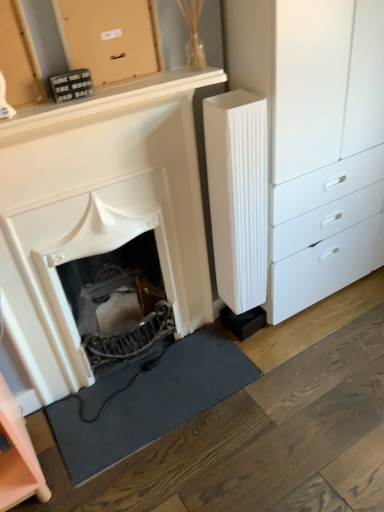
Describe the element at coordinates (98, 212) in the screenshot. I see `white matte fireplace at center` at that location.

You are a GUI agent. You are given a task and a screenshot of the screen. Output one action in this format:
    pyautogui.click(x=<x>, y=<y>)
    Task: Click on the white matte chest of drawers at right
    The height and width of the screenshot is (512, 384).
    Given the screenshot: What is the action you would take?
    pyautogui.click(x=316, y=137)

The width and height of the screenshot is (384, 512). What do you see at coordinates (109, 38) in the screenshot?
I see `wooden board at upper center, which is the 1th cabinetry in right-to-left order` at bounding box center [109, 38].

Measure the distance between black rubber doormat at lower left and camera.

A distance of 4.36 feet exists between black rubber doormat at lower left and camera.

What do you see at coordinates (18, 457) in the screenshot? Image resolution: width=384 pixels, height=512 pixels. I see `pink matte cabinet at lower left, the second cabinetry in the right-to-left sequence` at bounding box center [18, 457].

I want to click on white matte fireplace at center, so pos(98,212).

Is white matte fireplace at center thinner than white ribbed radiator at right?

Incorrect, the width of white matte fireplace at center is not less than that of white ribbed radiator at right.

Measure the distance between white matte fireplace at center and white ribbed radiator at right.

white matte fireplace at center is 11.62 inches away from white ribbed radiator at right.

Is white matte fireplace at center smaller than white ribbed radiator at right?

Actually, white matte fireplace at center might be larger than white ribbed radiator at right.

Which is correct: white matte fireplace at center is inside white ribbed radiator at right, or outside of it?

The correct answer is: outside.

Does point (295, 120) come behind point (72, 221)?

Yes, point (295, 120) is behind point (72, 221).

Who is more distant, white matte chest of drawers at right or white matte fireplace at center?

Positioned behind is white matte chest of drawers at right.

In the image, is white matte chest of drawers at right on the left side or the right side of white matte fireplace at center?

Clearly, white matte chest of drawers at right is on the right of white matte fireplace at center in the image.

From a real-world perspective, is white matte chest of drawers at right positioned under white matte fireplace at center based on gravity?

Actually, white matte chest of drawers at right is physically above white matte fireplace at center in the real world.

Can you confirm if white ribbed radiator at right is taller than white matte chest of drawers at right?

No.

From the image's perspective, between white ribbed radiator at right and white matte chest of drawers at right, which one is located above?

white matte chest of drawers at right is shown above in the image.

Which is behind, white ribbed radiator at right or white matte chest of drawers at right?

white ribbed radiator at right is further away from the camera.

Can you confirm if white ribbed radiator at right is wider than white matte chest of drawers at right?

No, white ribbed radiator at right is not wider than white matte chest of drawers at right.

The height and width of the screenshot is (512, 384). I want to click on the chest of drawers that is behind the wooden board at upper center, which is the 1th cabinetry in right-to-left order, so click(x=316, y=137).

In the scene shown: Considering the relative positions of white matte chest of drawers at right and wooden board at upper center, which is the 1th cabinetry in right-to-left order, in the image provided, is white matte chest of drawers at right to the left of wooden board at upper center, which is the 1th cabinetry in right-to-left order, from the viewer's perspective?

No.

Is white matte chest of drawers at right not close to wooden board at upper center, arranged as the first cabinetry when viewed from the top?

white matte chest of drawers at right is near wooden board at upper center, arranged as the first cabinetry when viewed from the top, not far away.

From a real-world perspective, who is located higher, white matte chest of drawers at right or wooden board at upper center, which is the 1th cabinetry in right-to-left order?

In real-world perspective, wooden board at upper center, which is the 1th cabinetry in right-to-left order, is above.

Is the position of pink matte cabinet at lower left, the second cabinetry in the right-to-left sequence, more distant than that of wooden board at upper center, placed as the 2th cabinetry when sorted from bottom to top?

Yes, pink matte cabinet at lower left, the second cabinetry in the right-to-left sequence, is behind wooden board at upper center, placed as the 2th cabinetry when sorted from bottom to top.

Image resolution: width=384 pixels, height=512 pixels. What are the coordinates of `cabinetry above the pink matte cabinet at lower left, the second cabinetry in the right-to-left sequence (from a real-world perspective)` in the screenshot? It's located at (109, 38).

How distant is pink matte cabinet at lower left, which is the 1th cabinetry from bottom to top, from wooden board at upper center, arranged as the first cabinetry when viewed from the top?

pink matte cabinet at lower left, which is the 1th cabinetry from bottom to top, and wooden board at upper center, arranged as the first cabinetry when viewed from the top, are 38.54 inches apart from each other.

Which is further, (40, 474) or (86, 38)?

The point (40, 474) is behind.

You are a GUI agent. You are given a task and a screenshot of the screen. Output one action in this format:
    pyautogui.click(x=<x>, y=<y>)
    Task: Click on the fireplace below the wooden board at upper center, which is the 1th cabinetry in right-to-left order (from the image's perspective)
    Image resolution: width=384 pixels, height=512 pixels.
    Given the screenshot: What is the action you would take?
    pyautogui.click(x=98, y=212)

Can you confirm if wooden board at upper center, which is the 1th cabinetry in right-to-left order, is smaller than white matte fireplace at center?

Indeed, wooden board at upper center, which is the 1th cabinetry in right-to-left order, has a smaller size compared to white matte fireplace at center.

Considering the sizes of objects wooden board at upper center, placed as the 2th cabinetry when sorted from bottom to top, and white matte fireplace at center in the image provided, who is shorter, wooden board at upper center, placed as the 2th cabinetry when sorted from bottom to top, or white matte fireplace at center?

wooden board at upper center, placed as the 2th cabinetry when sorted from bottom to top, is shorter.

Is pink matte cabinet at lower left, the second cabinetry in the right-to-left sequence, in front of or behind white matte fireplace at center in the image?

pink matte cabinet at lower left, the second cabinetry in the right-to-left sequence, is behind white matte fireplace at center.

Considering the points (16, 480) and (117, 167), which point is in front, point (16, 480) or point (117, 167)?

Point (16, 480)

Image resolution: width=384 pixels, height=512 pixels. What are the coordinates of `cabinetry on the left of white matte fireplace at center` in the screenshot? It's located at (x=18, y=457).

Would you say white matte fireplace at center is part of pink matte cabinet at lower left, which is the 1th cabinetry from bottom to top,'s contents?

No, white matte fireplace at center is located outside of pink matte cabinet at lower left, which is the 1th cabinetry from bottom to top.

This screenshot has width=384, height=512. I want to click on fireplace located in front of the white ribbed radiator at right, so click(98, 212).

Image resolution: width=384 pixels, height=512 pixels. Identify the location of the chest of drawers above the white matte fireplace at center (from the image's perspective). (316, 137).

Estimate the real-world distances between objects in this image. Which object is further from white ribbed radiator at right, black rubber doormat at lower left or wooden board at upper center, which is counted as the second cabinetry, starting from the left?

The object further to white ribbed radiator at right is black rubber doormat at lower left.

When comparing their distances from white matte chest of drawers at right, does white ribbed radiator at right or black rubber doormat at lower left seem closer?

white ribbed radiator at right lies closer to white matte chest of drawers at right than the other object.

Based on their spatial positions, is pink matte cabinet at lower left, the first cabinetry in the left-to-right sequence, or white matte chest of drawers at right closer to white matte fireplace at center?

Among the two, white matte chest of drawers at right is located nearer to white matte fireplace at center.

Based on their spatial positions, is white matte fireplace at center or pink matte cabinet at lower left, arranged as the second cabinetry when viewed from the top, further from white matte chest of drawers at right?

Based on the image, pink matte cabinet at lower left, arranged as the second cabinetry when viewed from the top, appears to be further to white matte chest of drawers at right.

Considering their positions, is wooden board at upper center, which is the 1th cabinetry in right-to-left order, positioned further to pink matte cabinet at lower left, which is the 1th cabinetry from bottom to top, than black rubber doormat at lower left?

wooden board at upper center, which is the 1th cabinetry in right-to-left order, is further to pink matte cabinet at lower left, which is the 1th cabinetry from bottom to top.

Looking at the image, which one is located further to white ribbed radiator at right, white matte fireplace at center or white matte chest of drawers at right?

white matte fireplace at center is further to white ribbed radiator at right.

Looking at the image, which one is located closer to wooden board at upper center, which is counted as the second cabinetry, starting from the left, pink matte cabinet at lower left, which is the 1th cabinetry from bottom to top, or white matte chest of drawers at right?

white matte chest of drawers at right is positioned closer to the anchor wooden board at upper center, which is counted as the second cabinetry, starting from the left.

Looking at the image, which one is located further to pink matte cabinet at lower left, the first cabinetry in the left-to-right sequence, white matte fireplace at center or white matte chest of drawers at right?

white matte chest of drawers at right.

In order to click on appliance between wooden board at upper center, arranged as the first cabinetry when viewed from the top, and black rubber doormat at lower left from top to bottom in this screenshot , I will do `click(238, 195)`.

The width and height of the screenshot is (384, 512). Identify the location of appliance situated between white matte fireplace at center and white matte chest of drawers at right from left to right. (238, 195).

In order to click on appliance between wooden board at upper center, which is counted as the second cabinetry, starting from the left, and white matte chest of drawers at right in this screenshot , I will do `click(238, 195)`.

Where is `cabinetry between white matte fireplace at center and white matte chest of drawers at right in the horizontal direction`? cabinetry between white matte fireplace at center and white matte chest of drawers at right in the horizontal direction is located at coordinates (109, 38).